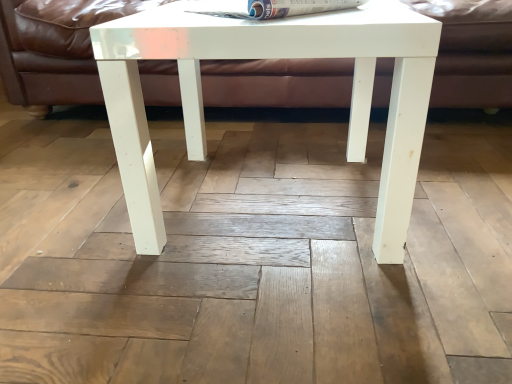
Locate an element on the screen. The image size is (512, 384). vacant space underneath white glossy table at center (from a real-world perspective) is located at coordinates (268, 196).